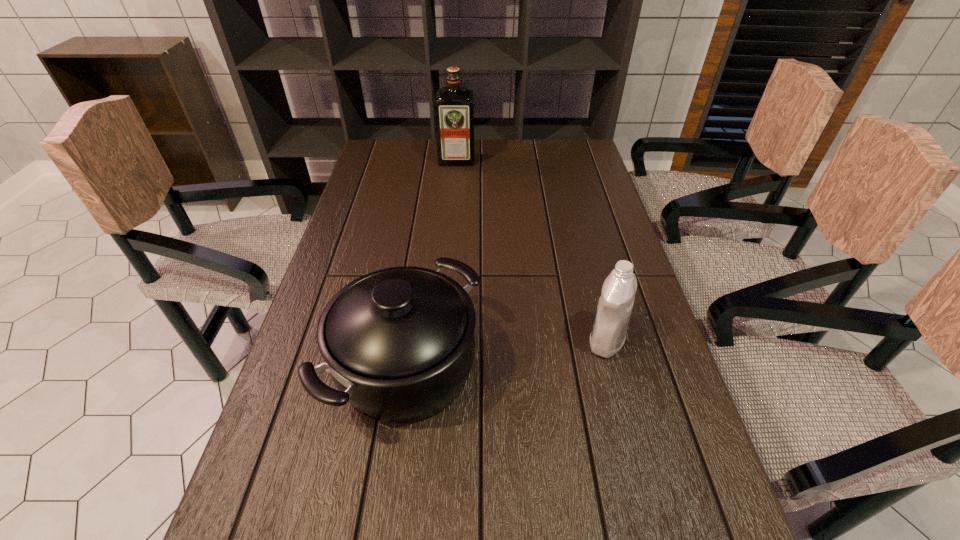
I want to click on vacant space that satisfies the following two spatial constraints: 1. on the front label of the farthest object; 2. on the left side of the detergent, so click(444, 341).